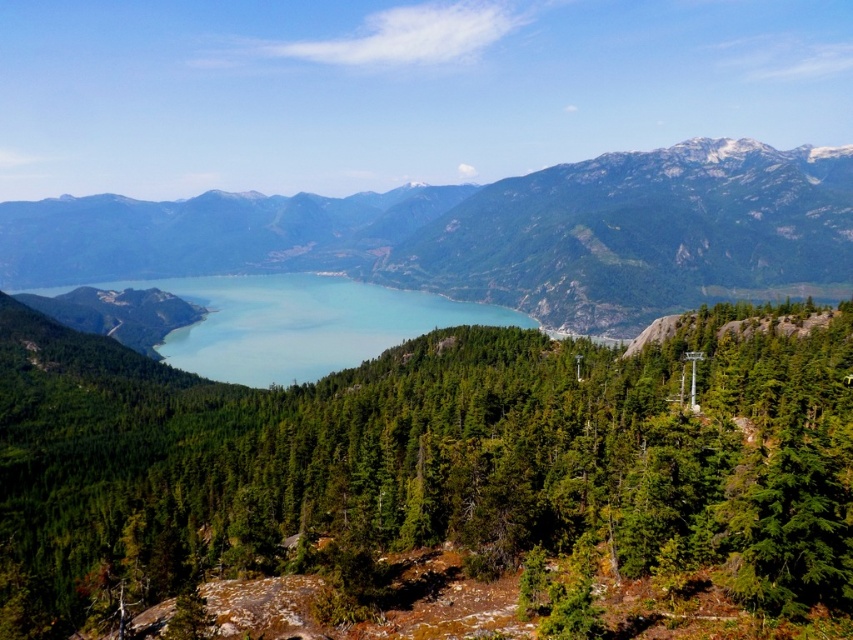
Who is lower down, green textured mountain at center or blue glassy water at center?

Positioned lower is blue glassy water at center.

Does green textured mountain at center have a greater width compared to blue glassy water at center?

Yes, green textured mountain at center is wider than blue glassy water at center.

Identify the location of green textured mountain at center. This screenshot has height=640, width=853. (494, 234).

Is green matte tree at center above green textured mountain at center?

Incorrect, green matte tree at center is not positioned above green textured mountain at center.

Looking at this image, between green matte tree at center and green textured mountain at center, which one appears on the left side from the viewer's perspective?

From the viewer's perspective, green textured mountain at center appears more on the left side.

Does point (47, 353) lie in front of point (817, 269)?

Yes, point (47, 353) is closer to viewer.

Locate an element on the screen. The height and width of the screenshot is (640, 853). green matte tree at center is located at coordinates coord(424,461).

Consider the image. Is green matte tree at center positioned before blue glassy water at center?

Yes, green matte tree at center is closer to the viewer.

Describe the element at coordinates (424, 461) in the screenshot. The height and width of the screenshot is (640, 853). I see `green matte tree at center` at that location.

In order to click on green matte tree at center in this screenshot , I will do `click(424, 461)`.